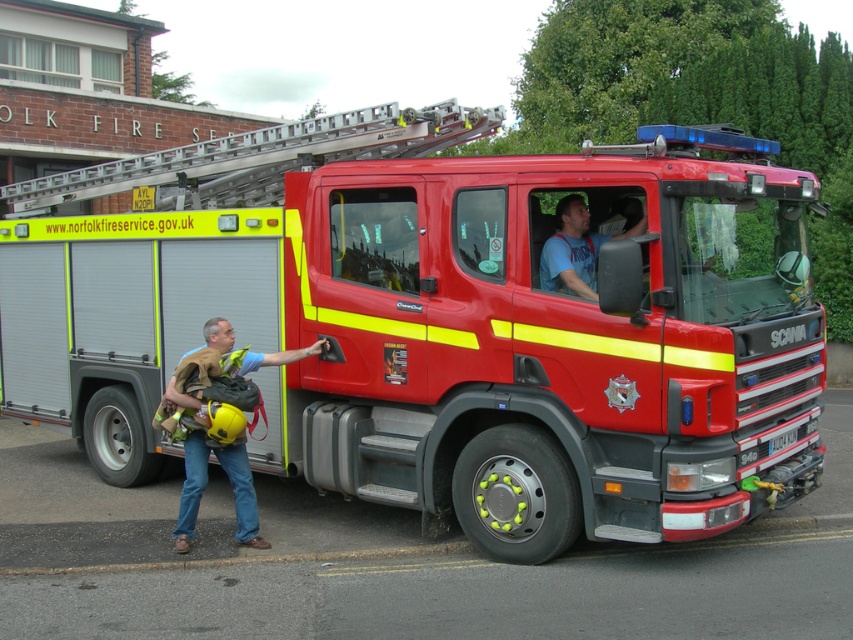
Question: Does metallic red fire truck at center have a smaller size compared to hard hat at left?

Choices:
 (A) yes
 (B) no

Answer: (B)

Question: Based on their relative distances, which object is farther from the metallic red fire truck at center?

Choices:
 (A) blue cotton shirt at center
 (B) hard hat at left
 (C) silver metallic ladder at upper center

Answer: (C)

Question: Which object appears farthest from the camera in this image?

Choices:
 (A) metallic red fire truck at center
 (B) silver metallic ladder at upper center
 (C) blue cotton shirt at center
 (D) hard hat at left

Answer: (B)

Question: Does silver metallic ladder at upper center lie behind blue cotton shirt at center?

Choices:
 (A) yes
 (B) no

Answer: (A)

Question: Among these objects, which one is farthest from the camera?

Choices:
 (A) metallic red fire truck at center
 (B) hard hat at left

Answer: (B)

Question: Is silver metallic ladder at upper center smaller than blue cotton shirt at center?

Choices:
 (A) yes
 (B) no

Answer: (B)